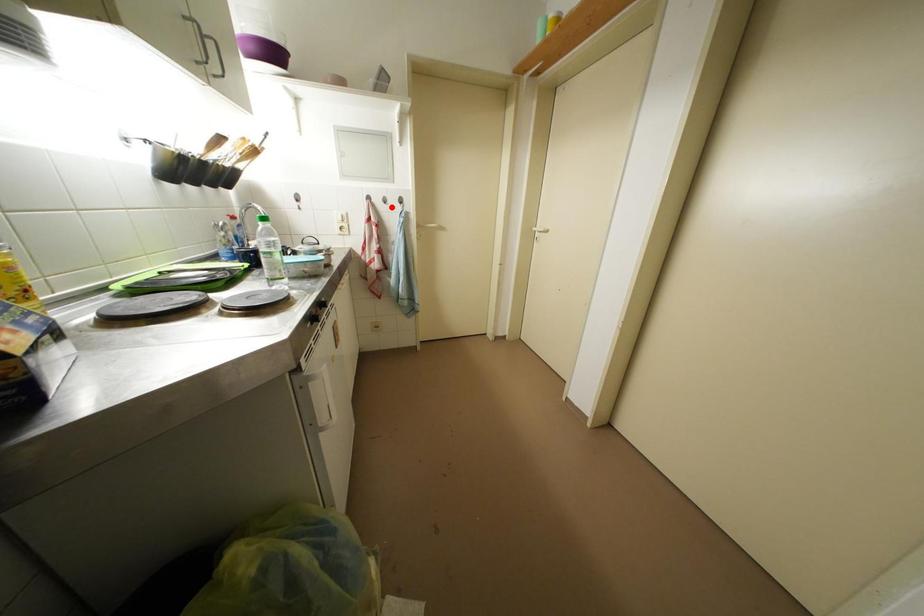
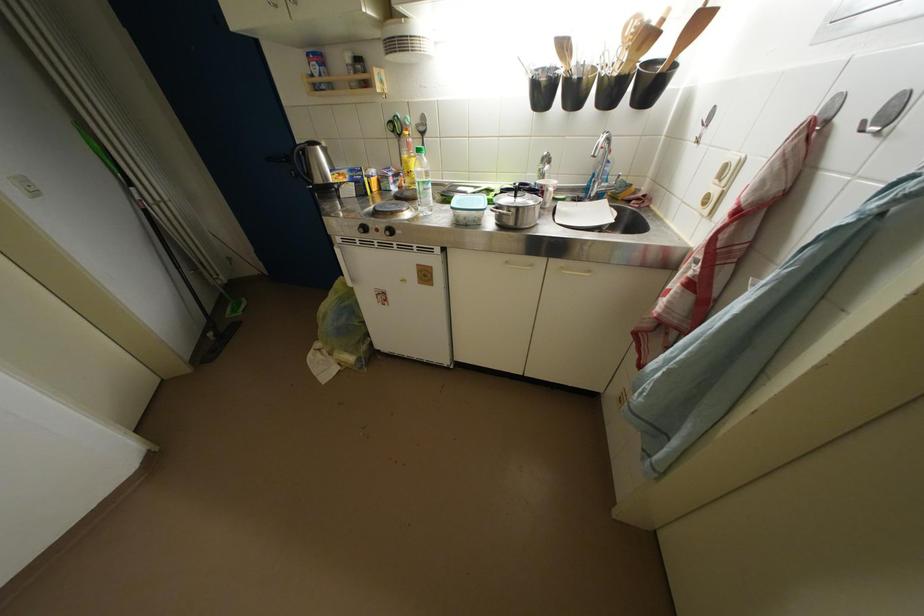
Question: I am providing you with two images of the same scene from different viewpoints. Image1 has a red point marked. In image2, the corresponding 3D location appears at what relative position? Reply with the corresponding letter.

Choices:
 (A) Closer
 (B) Farther

Answer: (B)